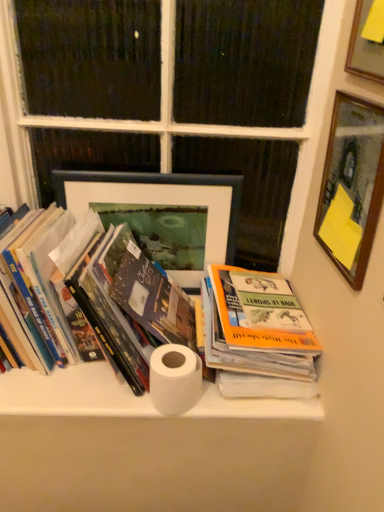
Describe the element at coordinates (351, 186) in the screenshot. I see `wooden picture frame at upper right, acting as the second picture frame starting from the right` at that location.

Where is `hardcover book at left, the second book from the right`? hardcover book at left, the second book from the right is located at coordinates (122, 295).

How much space does matte black picture frame at center, the first picture frame in the left-to-right sequence, occupy horizontally?

It is 0.82 inches.

Where is `white matte toilet paper at center`? This screenshot has height=512, width=384. white matte toilet paper at center is located at coordinates (175, 379).

This screenshot has height=512, width=384. What are the coordinates of `orange matte book at center, the first book positioned from the right` in the screenshot? It's located at (255, 337).

Which is in front, point (320, 418) or point (376, 62)?

The point (376, 62) is more forward.

From the image's perspective, which one is positioned higher, white paper towel at center or wooden frame at upper right, which ranks as the 3th picture frame in left-to-right order?

From the image's view, wooden frame at upper right, which ranks as the 3th picture frame in left-to-right order, is above.

Considering the sizes of white paper towel at center and wooden frame at upper right, which is the 1th picture frame from right to left, in the image, is white paper towel at center taller or shorter than wooden frame at upper right, which is the 1th picture frame from right to left,?

Considering their sizes, white paper towel at center has less height than wooden frame at upper right, which is the 1th picture frame from right to left.

Could you tell me if white paper towel at center is facing wooden frame at upper right, which is the 1th picture frame from right to left?

No, white paper towel at center is not turned towards wooden frame at upper right, which is the 1th picture frame from right to left.

Is orange matte book at center, the first book positioned from the right, outside of hardcover book at left, the second book from the right?

Yes, orange matte book at center, the first book positioned from the right, is outside of hardcover book at left, the second book from the right.

Looking at this image, is orange matte book at center, which ranks as the second book in left-to-right order, far from hardcover book at left, which ranks as the first book in left-to-right order?

No.

Considering the relative positions of orange matte book at center, the first book positioned from the right, and hardcover book at left, which ranks as the first book in left-to-right order, in the image provided, is orange matte book at center, the first book positioned from the right, to the left of hardcover book at left, which ranks as the first book in left-to-right order, from the viewer's perspective?

Incorrect, orange matte book at center, the first book positioned from the right, is not on the left side of hardcover book at left, which ranks as the first book in left-to-right order.

Is point (146, 252) more distant than point (381, 136)?

That is True.

Looking at their sizes, would you say matte black picture frame at center, positioned as the 3th picture frame in front-to-back order, is wider or thinner than wooden picture frame at upper right, acting as the second picture frame starting from the right?

Considering their sizes, matte black picture frame at center, positioned as the 3th picture frame in front-to-back order, looks slimmer than wooden picture frame at upper right, acting as the second picture frame starting from the right.

Locate an element on the screen. picture frame that is under the wooden picture frame at upper right, acting as the second picture frame starting from the right (from a real-world perspective) is located at coordinates [x=162, y=214].

In the image, is matte black picture frame at center, which is counted as the first picture frame, starting from the back, positioned in front of or behind wooden picture frame at upper right, which is the 2th picture frame from back to front?

Clearly, matte black picture frame at center, which is counted as the first picture frame, starting from the back, is behind wooden picture frame at upper right, which is the 2th picture frame from back to front.

Is point (333, 238) closer to camera compared to point (116, 192)?

Yes.

Is the depth of wooden picture frame at upper right, the second picture frame when ordered from left to right, less than that of matte black picture frame at center, the third picture frame when ordered from right to left?

Yes, it is.

From the image's perspective, which one is positioned lower, wooden picture frame at upper right, which is the second picture frame from front to back, or matte black picture frame at center, positioned as the 3th picture frame in front-to-back order?

From the image's view, matte black picture frame at center, positioned as the 3th picture frame in front-to-back order, is below.

Is wooden picture frame at upper right, acting as the second picture frame starting from the right, oriented away from matte black picture frame at center, the third picture frame when ordered from right to left?

No, matte black picture frame at center, the third picture frame when ordered from right to left, is not at the back of wooden picture frame at upper right, acting as the second picture frame starting from the right.

Are orange matte book at center, which ranks as the second book in left-to-right order, and wooden picture frame at upper right, acting as the second picture frame starting from the right, located far from each other?

Actually, orange matte book at center, which ranks as the second book in left-to-right order, and wooden picture frame at upper right, acting as the second picture frame starting from the right, are a little close together.

From a real-world perspective, is orange matte book at center, which ranks as the second book in left-to-right order, below wooden picture frame at upper right, the second picture frame when ordered from left to right?

Yes, from a real-world perspective, orange matte book at center, which ranks as the second book in left-to-right order, is beneath wooden picture frame at upper right, the second picture frame when ordered from left to right.

Is orange matte book at center, the first book positioned from the right, not within wooden picture frame at upper right, acting as the second picture frame starting from the right?

Absolutely, orange matte book at center, the first book positioned from the right, is external to wooden picture frame at upper right, acting as the second picture frame starting from the right.

From the picture: Between orange matte book at center, the first book positioned from the right, and wooden picture frame at upper right, which is the 2th picture frame from back to front, which one appears on the right side from the viewer's perspective?

From the viewer's perspective, wooden picture frame at upper right, which is the 2th picture frame from back to front, appears more on the right side.

Which of these two, orange matte book at center, which ranks as the second book in left-to-right order, or wooden frame at upper right, which is the 3th picture frame from back to front, stands shorter?

With less height is orange matte book at center, which ranks as the second book in left-to-right order.

Between point (250, 327) and point (376, 76), which one is positioned in front?

Point (376, 76)

Can we say orange matte book at center, the first book positioned from the right, lies outside wooden frame at upper right, the 1th picture frame in the front-to-back sequence?

orange matte book at center, the first book positioned from the right, is positioned outside wooden frame at upper right, the 1th picture frame in the front-to-back sequence.

Is the position of orange matte book at center, which ranks as the second book in left-to-right order, more distant than that of wooden frame at upper right, which is the 1th picture frame from right to left?

Yes, it is.

From the image's perspective, relative to hardcover book at left, the second book from the right, is wooden frame at upper right, the 1th picture frame in the front-to-back sequence, above or below?

wooden frame at upper right, the 1th picture frame in the front-to-back sequence, is situated higher than hardcover book at left, the second book from the right, in the image.

In terms of width, does wooden frame at upper right, which is the 3th picture frame from back to front, look wider or thinner when compared to hardcover book at left, which ranks as the first book in left-to-right order?

Clearly, wooden frame at upper right, which is the 3th picture frame from back to front, has less width compared to hardcover book at left, which ranks as the first book in left-to-right order.

From a real-world perspective, which is physically above, wooden frame at upper right, which is the 1th picture frame from right to left, or hardcover book at left, the second book from the right?

wooden frame at upper right, which is the 1th picture frame from right to left, from a real-world perspective.

Does wooden frame at upper right, which is the 1th picture frame from right to left, appear on the right side of hardcover book at left, the second book from the right?

Indeed, wooden frame at upper right, which is the 1th picture frame from right to left, is positioned on the right side of hardcover book at left, the second book from the right.

Image resolution: width=384 pixels, height=512 pixels. In order to click on shelf located behind the wooden frame at upper right, which is the 3th picture frame from back to front in this screenshot , I will do `click(71, 394)`.

Find the location of a particular element. This screenshot has height=512, width=384. book above the orange matte book at center, the first book positioned from the right (from the image's perspective) is located at coordinates (122, 295).

From the image, which object appears to be farther from orange matte book at center, the first book positioned from the right, white painted wood at upper center or white matte toilet paper at center?

white painted wood at upper center is further to orange matte book at center, the first book positioned from the right.

Which object lies further to the anchor point hardcover book at left, which ranks as the first book in left-to-right order, white paper towel at center or wooden picture frame at upper right, the second picture frame when ordered from left to right?

wooden picture frame at upper right, the second picture frame when ordered from left to right, lies further to hardcover book at left, which ranks as the first book in left-to-right order, than the other object.

Based on their spatial positions, is hardcover book at left, which ranks as the first book in left-to-right order, or orange matte book at center, the first book positioned from the right, closer to white painted wood at upper center?

orange matte book at center, the first book positioned from the right, is closer to white painted wood at upper center.

In the scene shown: Which object lies nearer to the anchor point wooden frame at upper right, which ranks as the 3th picture frame in left-to-right order, white paper towel at center or hardcover book at left, the second book from the right?

hardcover book at left, the second book from the right, is closer to wooden frame at upper right, which ranks as the 3th picture frame in left-to-right order.

When comparing their distances from wooden picture frame at upper right, which is the 2th picture frame from back to front, does white matte toilet paper at center or white painted wood at upper center seem closer?

The object closer to wooden picture frame at upper right, which is the 2th picture frame from back to front, is white painted wood at upper center.

From the image, which object appears to be farther from orange matte book at center, the first book positioned from the right, wooden picture frame at upper right, acting as the second picture frame starting from the right, or white paper towel at center?

Among the two, wooden picture frame at upper right, acting as the second picture frame starting from the right, is located further to orange matte book at center, the first book positioned from the right.

Looking at this image, estimate the real-world distances between objects in this image. Which object is further from white matte toilet paper at center, matte black picture frame at center, positioned as the 3th picture frame in front-to-back order, or white paper towel at center?

Based on the image, matte black picture frame at center, positioned as the 3th picture frame in front-to-back order, appears to be further to white matte toilet paper at center.

Considering their positions, is matte black picture frame at center, the third picture frame when ordered from right to left, positioned closer to wooden frame at upper right, which is the 3th picture frame from back to front, than orange matte book at center, the first book positioned from the right?

matte black picture frame at center, the third picture frame when ordered from right to left, lies closer to wooden frame at upper right, which is the 3th picture frame from back to front, than the other object.

Locate an element on the screen. The height and width of the screenshot is (512, 384). picture frame positioned between wooden frame at upper right, which is the 3th picture frame from back to front, and matte black picture frame at center, positioned as the 3th picture frame in front-to-back order, from near to far is located at coordinates (351, 186).

Image resolution: width=384 pixels, height=512 pixels. In order to click on toilet paper between hardcover book at left, which ranks as the first book in left-to-right order, and wooden picture frame at upper right, which is the second picture frame from front to back, in the horizontal direction in this screenshot , I will do `click(175, 379)`.

Find the location of a particular element. This screenshot has width=384, height=512. toilet paper situated between hardcover book at left, which ranks as the first book in left-to-right order, and orange matte book at center, the first book positioned from the right, from left to right is located at coordinates (175, 379).

You are a GUI agent. You are given a task and a screenshot of the screen. Output one action in this format:
    pyautogui.click(x=<x>, y=<y>)
    Task: Click on the window frame that lies between wooden frame at upper right, the 1th picture frame in the front-to-back sequence, and white matte toilet paper at center from top to bottom
    
    Given the screenshot: What is the action you would take?
    pyautogui.click(x=166, y=120)